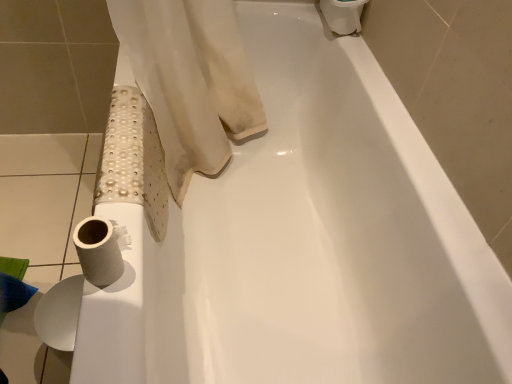
Where is `free area behind white matte toilet paper at lower left, acting as the 2th toilet paper starting from the bottom`? This screenshot has height=384, width=512. free area behind white matte toilet paper at lower left, acting as the 2th toilet paper starting from the bottom is located at coordinates (120, 196).